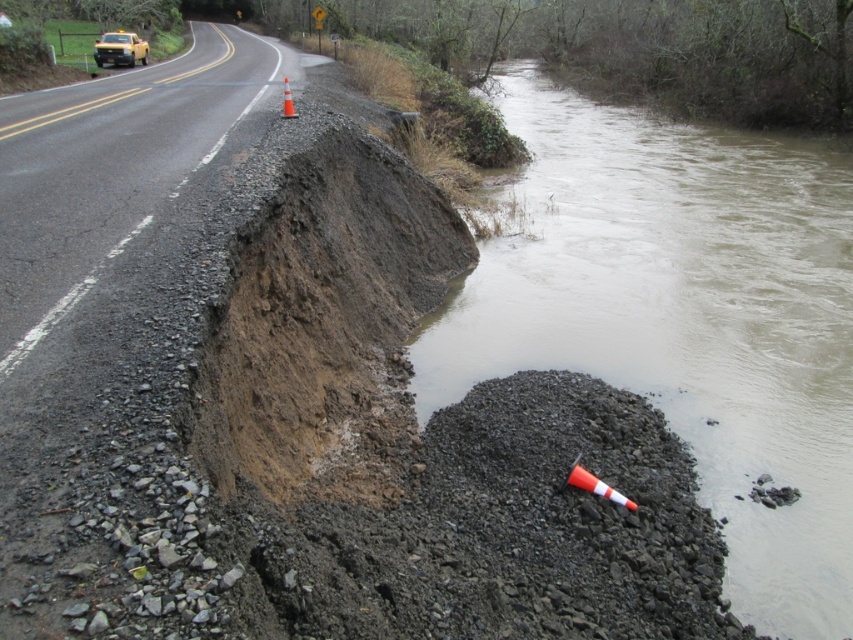
Question: In this image, where is brown dirt at center located relative to orange reflective cone at road center?

Choices:
 (A) left
 (B) right

Answer: (B)

Question: Can you confirm if brown dirt at center is positioned above yellow plastic car at upper left?

Choices:
 (A) no
 (B) yes

Answer: (A)

Question: Can you confirm if brown dirt at center is thinner than orange reflective cone at road center?

Choices:
 (A) no
 (B) yes

Answer: (B)

Question: Which of the following is the farthest from the observer?

Choices:
 (A) yellow plastic car at upper left
 (B) muddy gravel river at lower right
 (C) brown dirt at center

Answer: (A)

Question: Among these points, which one is nearest to the camera?

Choices:
 (A) (596, 481)
 (B) (288, 106)
 (C) (129, 40)
 (D) (238, 282)

Answer: (A)

Question: Which point is farther to the camera?

Choices:
 (A) (608, 493)
 (B) (132, 42)

Answer: (B)